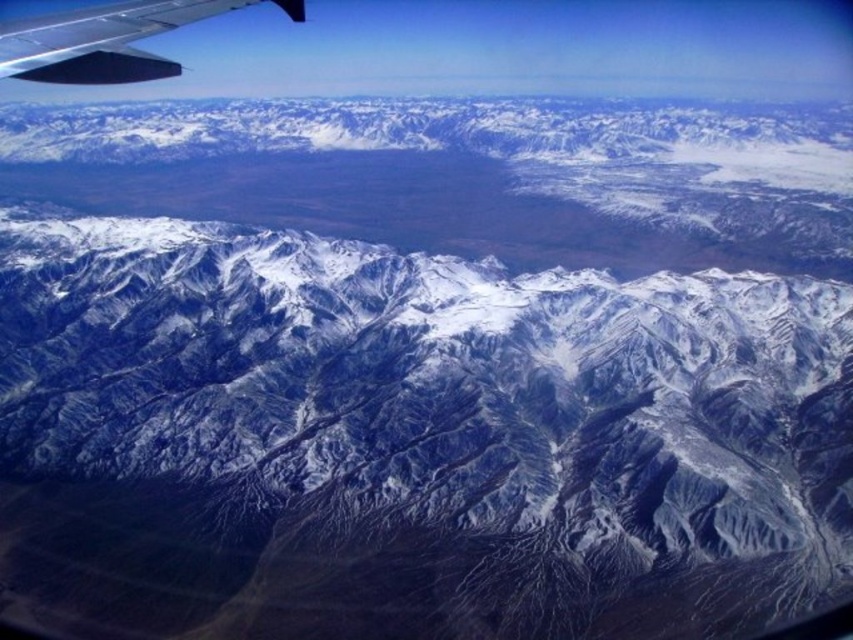
From the picture: You are a pilot observing the snowy rocky mountain range at center and the matte black wing at upper left from the cockpit. Which object is positioned to the right side of the other?

The snowy rocky mountain range at center is positioned to the right of the matte black wing at upper left.

You are a pilot flying an airplane at an altitude of 2000 feet. You look out the window and see the snowy rocky mountain range at center. Is the mountain range below or above your current altitude?

The distance between the snowy rocky mountain range at center and the camera is 1772.92 feet. Since the airplane is flying at 2000 feet altitude, the mountain range is below the airplane because the altitude of the airplane is higher than the distance to the mountain range.

You are a pilot flying an airplane and notice the snowy rocky mountain range at center and the matte black wing at upper left in your view. Which object is positioned higher in your field of view?

The snowy rocky mountain range at center is positioned higher in your field of view than the matte black wing at upper left because it is described as being above it.